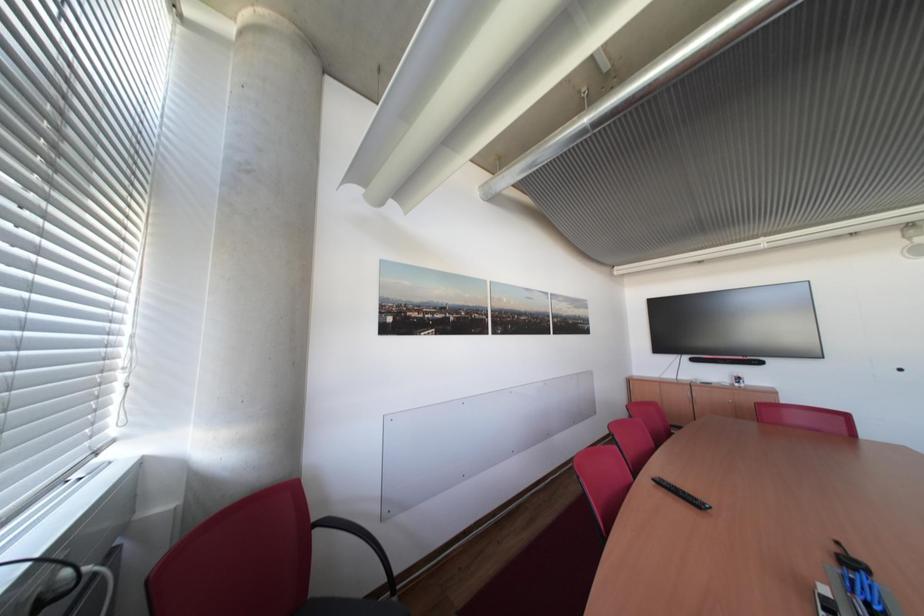
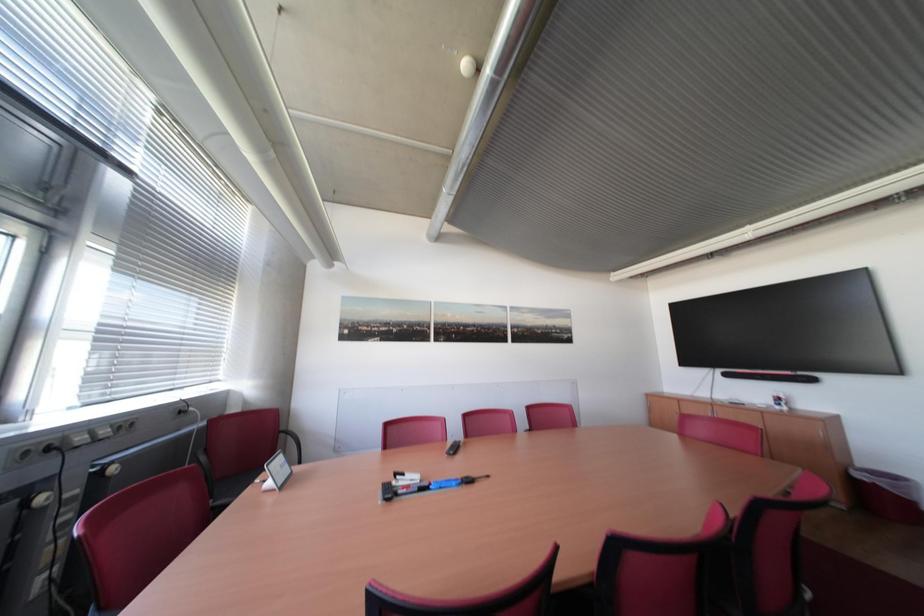
Question: Which direction would the cameraman need to move to produce the second image? Reply with the corresponding letter.

Choices:
 (A) Left
 (B) Right
 (C) Forward
 (D) Backward

Answer: (B)